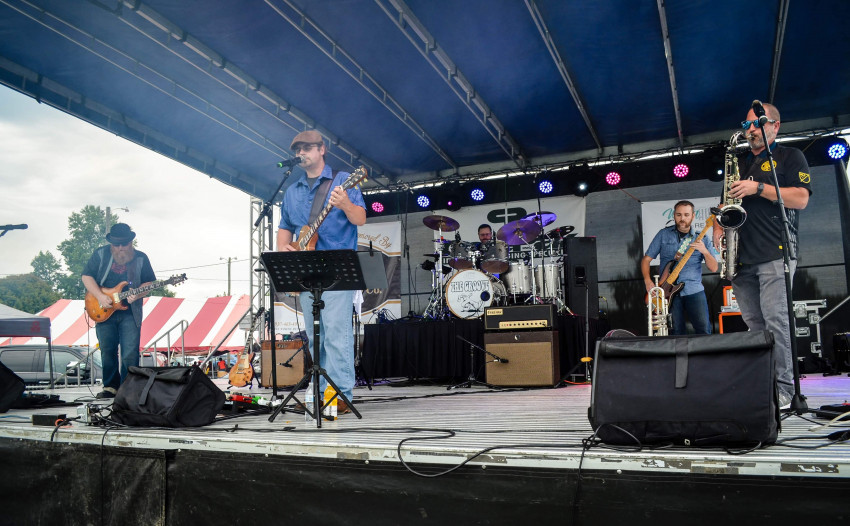
At what (x,y) coordinates should I click in order to perform the action: click on amplifier. Please return your answer as a coordinate pair (x, y). This screenshot has height=526, width=850. Looking at the image, I should click on (733, 323), (541, 361), (280, 375).